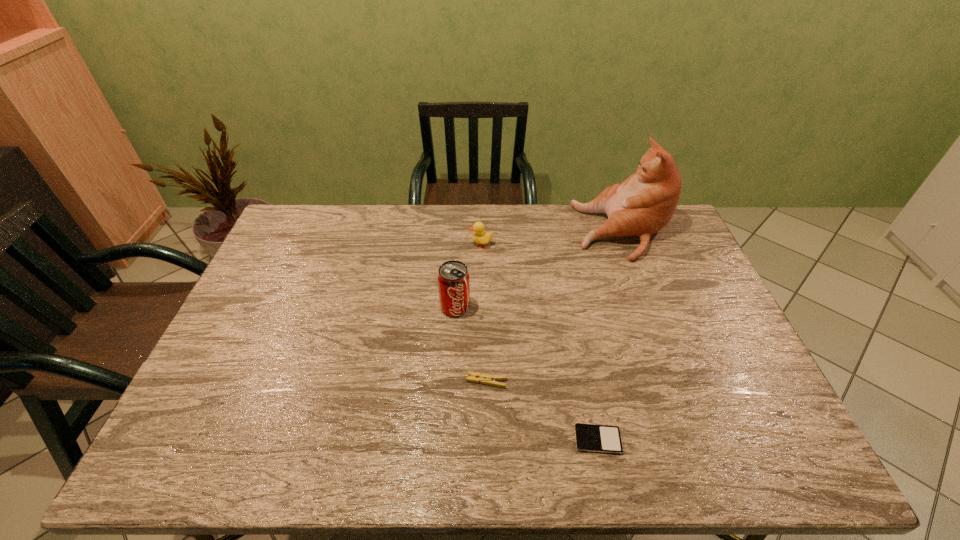
Find the location of a particular element. The height and width of the screenshot is (540, 960). vacant area that lies between the duckling and the cat is located at coordinates (552, 238).

Locate an element on the screen. vacant space that is in between the second nearest object and the duckling is located at coordinates (484, 313).

Where is `free space between the rightmost object and the iPod`? free space between the rightmost object and the iPod is located at coordinates (611, 335).

Where is `free space between the third tallest object and the nearest object`? Image resolution: width=960 pixels, height=540 pixels. free space between the third tallest object and the nearest object is located at coordinates (540, 342).

Identify the location of vacant space in between the nearest object and the duckling. Image resolution: width=960 pixels, height=540 pixels. (540, 342).

Where is `free space between the tallest object and the second nearest object`? The width and height of the screenshot is (960, 540). free space between the tallest object and the second nearest object is located at coordinates (555, 306).

Where is `the second closest object to the duckling`? the second closest object to the duckling is located at coordinates (643, 204).

The height and width of the screenshot is (540, 960). I want to click on the second closest object relative to the third nearest object, so click(480, 237).

Identify the location of vacant area that satisfies the following two spatial constraints: 1. on the front-facing side of the duckling; 2. on the back side of the fourth farthest object. Image resolution: width=960 pixels, height=540 pixels. pos(481,381).

The height and width of the screenshot is (540, 960). I want to click on vacant space that satisfies the following two spatial constraints: 1. on the front-facing side of the third tallest object; 2. on the right side of the nearest object, so click(x=481, y=440).